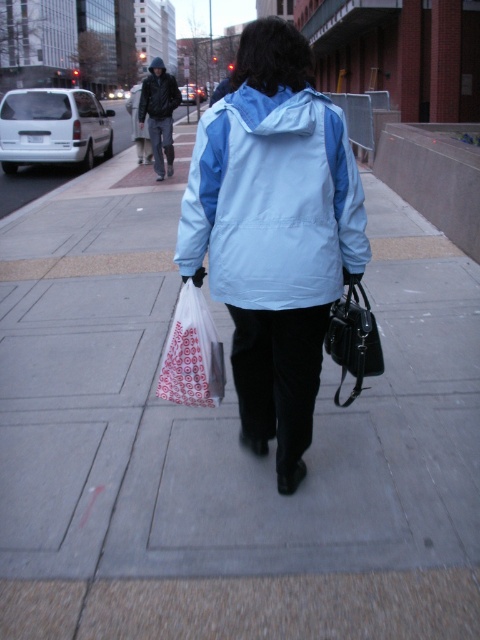
Which is below, light blue fabric jacket at center or black leather jacket at upper left?

light blue fabric jacket at center is below.

Is light blue fabric jacket at center below black leather jacket at upper left?

Yes, light blue fabric jacket at center is below black leather jacket at upper left.

Does point (225, 196) come in front of point (168, 84)?

Yes, it is.

Identify the location of light blue fabric jacket at center. This screenshot has width=480, height=640. (274, 232).

Is light blue fabric jacket at center wider than light blue/waterproof jacket at center?

Yes, light blue fabric jacket at center is wider than light blue/waterproof jacket at center.

Can you confirm if light blue fabric jacket at center is shorter than light blue/waterproof jacket at center?

No, light blue fabric jacket at center is not shorter than light blue/waterproof jacket at center.

Is point (299, 412) less distant than point (316, 276)?

No, (299, 412) is further to viewer.

Where is `light blue fabric jacket at center`? This screenshot has width=480, height=640. light blue fabric jacket at center is located at coordinates (274, 232).

Can you confirm if black leather handbag at center is bigger than black leather jacket at upper left?

Actually, black leather handbag at center might be smaller than black leather jacket at upper left.

Between black leather handbag at center and black leather jacket at upper left, which one has less height?

black leather handbag at center is shorter.

Locate an element on the screen. This screenshot has height=640, width=480. black leather handbag at center is located at coordinates (354, 339).

This screenshot has width=480, height=640. Identify the location of black leather handbag at center. (354, 339).